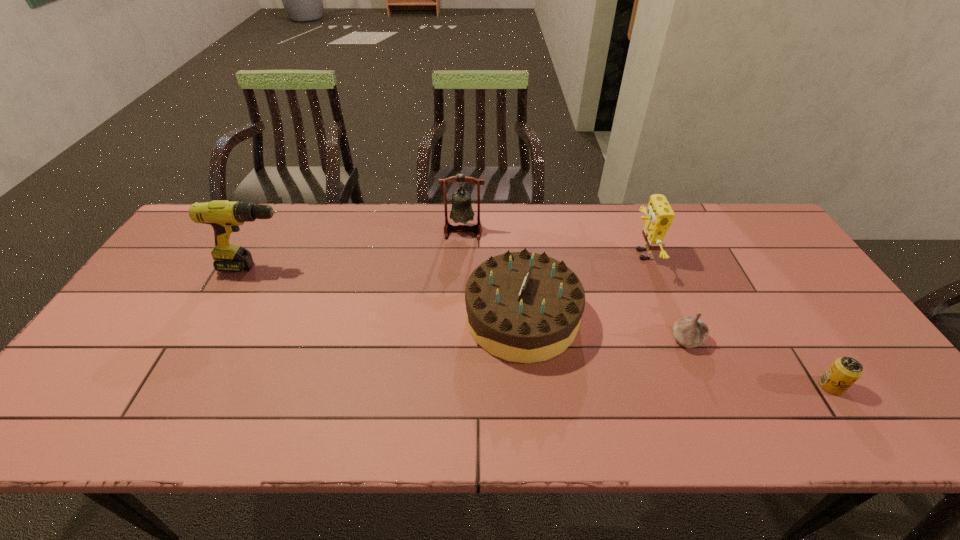
Where is `free region at the far edge of the desktop`? The width and height of the screenshot is (960, 540). free region at the far edge of the desktop is located at coordinates (581, 211).

Identify the location of free space at the near edge of the desktop. The width and height of the screenshot is (960, 540). tap(760, 433).

The image size is (960, 540). I want to click on vacant space at the left edge of the desktop, so click(167, 265).

Locate an element on the screen. The image size is (960, 540). free location at the right edge is located at coordinates (782, 285).

Find the location of a particular element. This screenshot has height=540, width=960. vacant region at the far right corner is located at coordinates (773, 247).

Where is `free point between the rightmost object and the birthday cake`? free point between the rightmost object and the birthday cake is located at coordinates (677, 352).

At what (x,y) coordinates should I click in order to perform the action: click on free space between the garlic and the shortest object. Please return your answer as a coordinate pair (x, y). The width and height of the screenshot is (960, 540). Looking at the image, I should click on (759, 362).

Where is `free space between the rightmost object and the birthday cake`? The image size is (960, 540). free space between the rightmost object and the birthday cake is located at coordinates (677, 352).

You are a GUI agent. You are given a task and a screenshot of the screen. Output one action in this format:
    pyautogui.click(x=<x>, y=<y>)
    Task: Click on the vacant area that lies between the bell and the sponge
    The image size is (960, 540).
    Given the screenshot: What is the action you would take?
    pyautogui.click(x=552, y=242)

Find the location of a particular element. The image size is (960, 540). free spot between the nearest object and the bell is located at coordinates (647, 308).